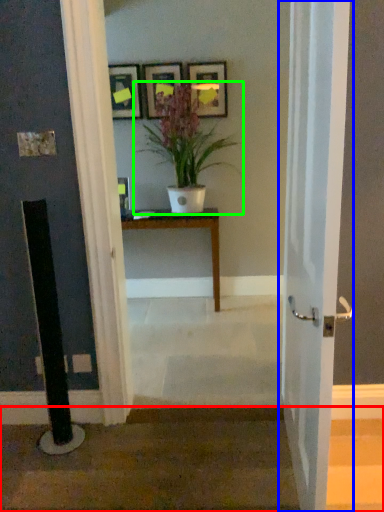
Question: Which object is positioned closest to stairwell (highlighted by a red box)? Select from door (highlighted by a blue box) and houseplant (highlighted by a green box).

Choices:
 (A) door
 (B) houseplant

Answer: (A)